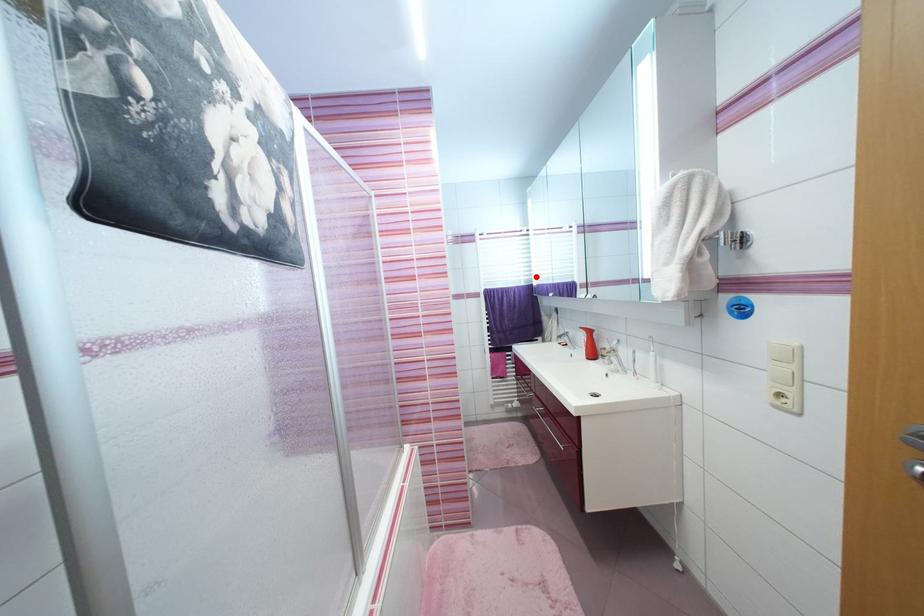
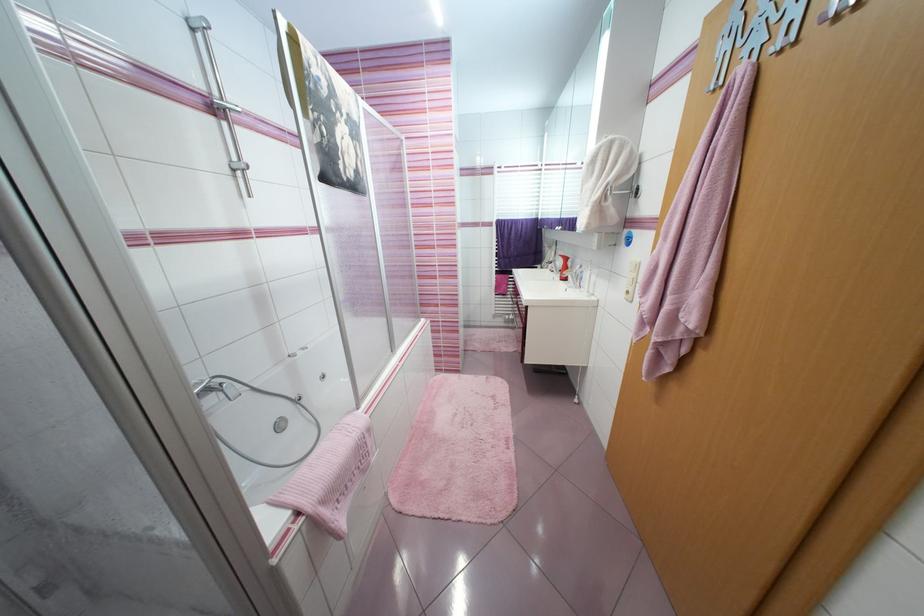
In the second image, find the point that corresponds to the highlighted location in the first image.

(543, 211)